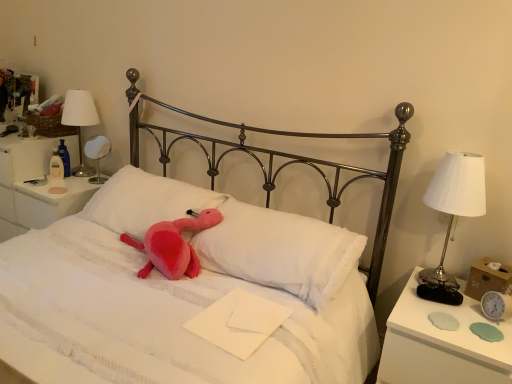
Image resolution: width=512 pixels, height=384 pixels. I want to click on vacant region to the left of silver metallic clock at right, so click(x=453, y=319).